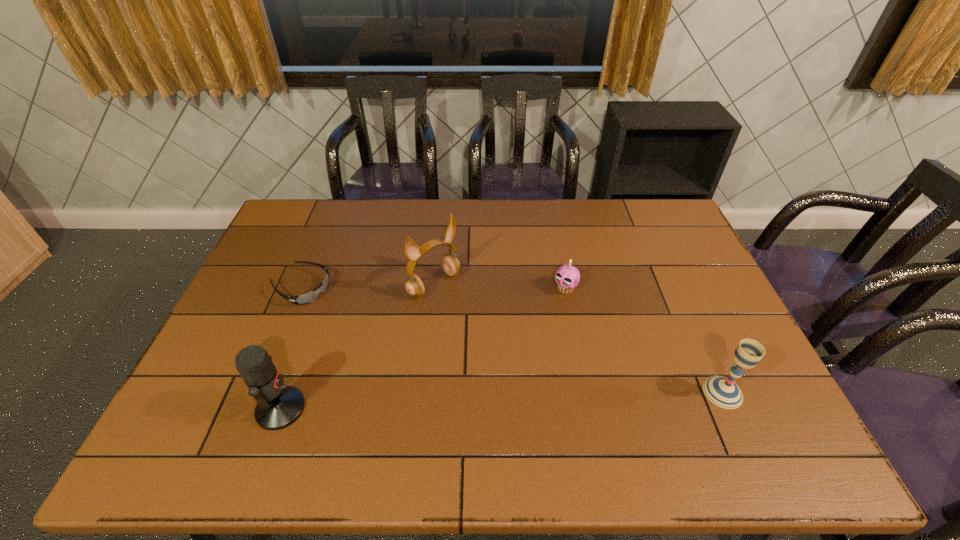
Locate an element on the screen. The height and width of the screenshot is (540, 960). microphone is located at coordinates (278, 406).

Where is `chalice`? The image size is (960, 540). chalice is located at coordinates (724, 392).

Locate an element on the screen. The image size is (960, 540). the third tallest object is located at coordinates (724, 392).

Identify the location of the third object from right to left. This screenshot has width=960, height=540. (414, 286).

Identify the location of cupcake. The height and width of the screenshot is (540, 960). (567, 277).

Where is `the second object from right to left`? The image size is (960, 540). the second object from right to left is located at coordinates (567, 277).

This screenshot has width=960, height=540. I want to click on the shortest object, so click(311, 296).

Where is `vacant space located 0.120m on the side of the microphone with the red ring`? Image resolution: width=960 pixels, height=540 pixels. vacant space located 0.120m on the side of the microphone with the red ring is located at coordinates (353, 409).

At what (x,y) coordinates should I click in order to perform the action: click on vacant space located on the back of the third tallest object. Please return your answer as a coordinate pair (x, y). Looking at the image, I should click on (691, 322).

Find the location of a particular element. The height and width of the screenshot is (540, 960). vacant space situated 0.090m on the front-facing side of the third object from right to left is located at coordinates (469, 314).